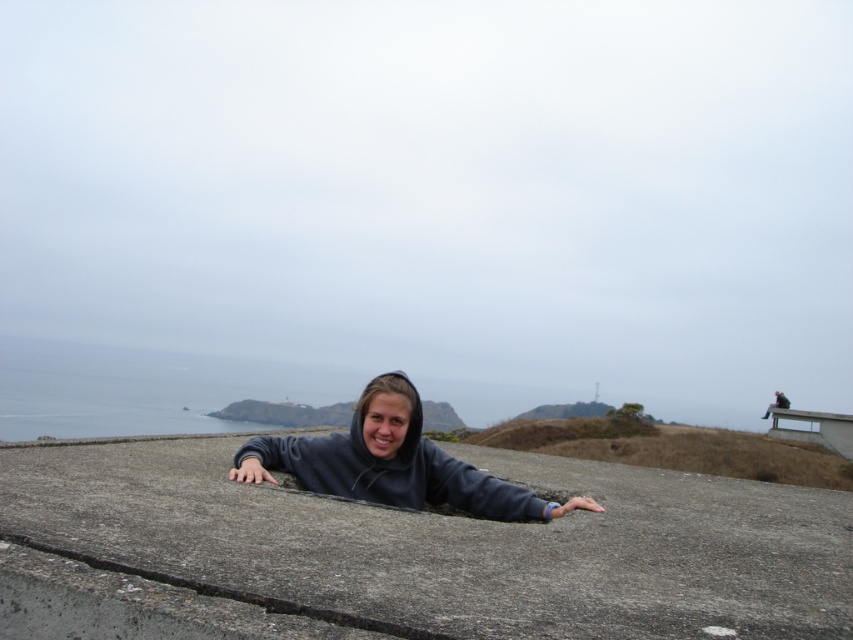
Is gray concrete at center to the right of dark gray hoodie at center from the viewer's perspective?

In fact, gray concrete at center is to the left of dark gray hoodie at center.

Which of these two, gray concrete at center or dark gray hoodie at center, stands taller?

dark gray hoodie at center is taller.

Image resolution: width=853 pixels, height=640 pixels. I want to click on gray concrete at center, so click(x=410, y=552).

Identify the location of gray concrete at center. (410, 552).